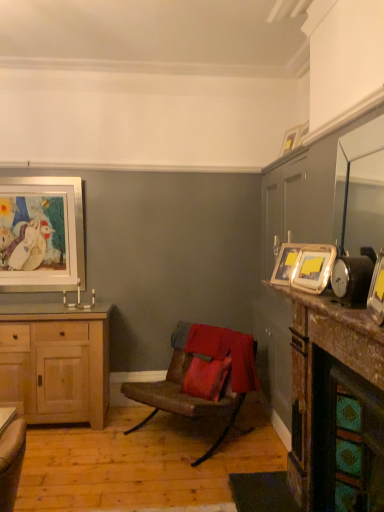
Question: Relative to matte gold picture frame at right, the second picture frame in the front-to-back sequence, is light wood cabinet at left in front or behind?

Choices:
 (A) behind
 (B) front

Answer: (A)

Question: Looking at the image, does light wood cabinet at left seem bigger or smaller compared to matte gold picture frame at right, the third picture frame positioned from the left?

Choices:
 (A) small
 (B) big

Answer: (B)

Question: Which object is positioned closest to the matte gold picture frame at right, the second picture frame in the front-to-back sequence?

Choices:
 (A) marble countertop at right, which is the 2th counter top from bottom to top
 (B) light wood cabinet at left
 (C) gold metallic picture frame at upper right, which is counted as the 3th picture frame, starting from the front
 (D) metallic gold picture frame at right, positioned as the first picture frame in front-to-back order
 (E) wooden picture frame at upper right, which ranks as the fourth picture frame in front-to-back order

Answer: (C)

Question: Which object is positioned closest to the light wood cabinet at left?

Choices:
 (A) wooden picture frame at upper right, which ranks as the fifth picture frame in left-to-right order
 (B) marble countertop at right, which is the 2th counter top from bottom to top
 (C) brown leather chair at center
 (D) metallic silver alarm clock at right
 (E) metallic gold picture frame at right, positioned as the first picture frame in front-to-back order

Answer: (C)